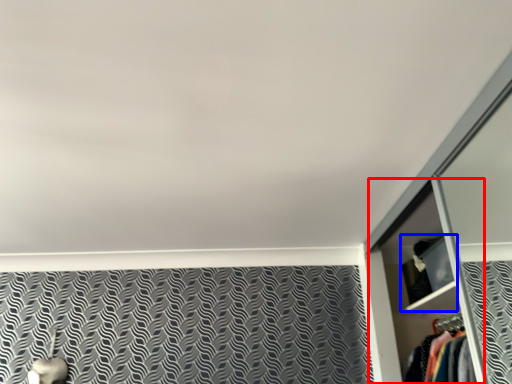
Question: Which point is closer to the camera, dresser (highlighted by a red box) or cabinet (highlighted by a blue box)?

Choices:
 (A) dresser
 (B) cabinet

Answer: (A)